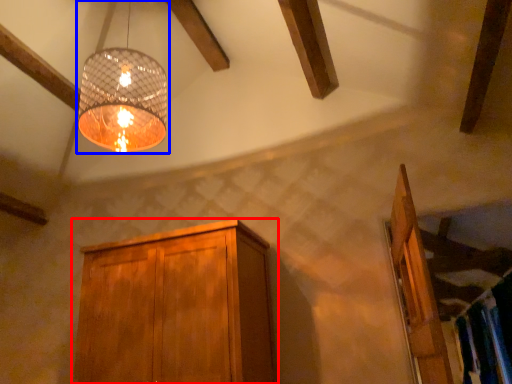
Question: Which object appears closest to the camera in this image, cabinetry (highlighted by a red box) or lamp (highlighted by a blue box)?

Choices:
 (A) cabinetry
 (B) lamp

Answer: (B)